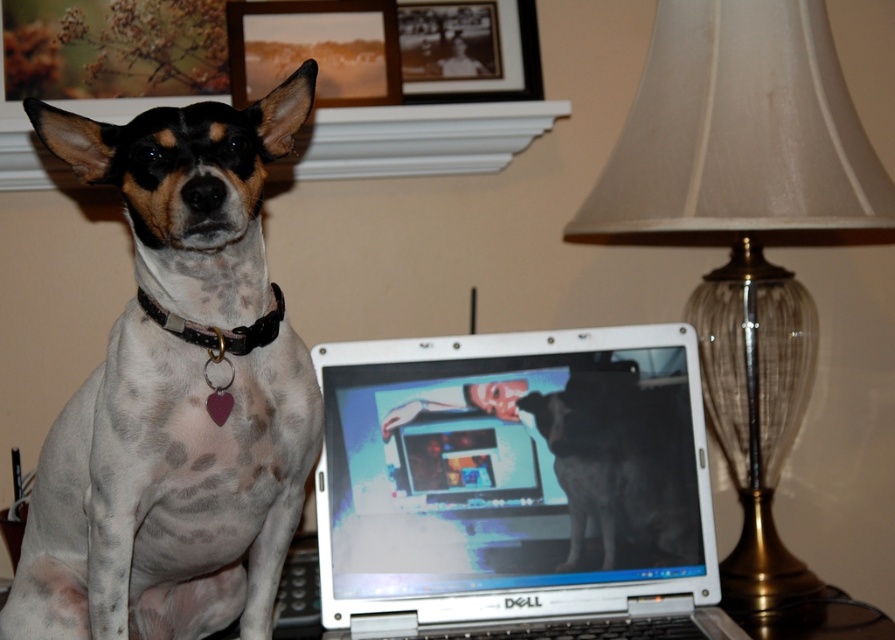
You are a photographer setting up a new shot in this scene. You want to place a small tripod between the speckled fur dog at left and the black matte picture frame at upper center. Based on their current positions, will the tripod fit horizontally between them?

The speckled fur dog at left is positioned on the left side of black matte picture frame at upper center, so there is space between them. The tripod should fit horizontally between them as long as it is placed appropriately.

You are standing at the origin of the coordinate system in the image. There are two points marked in the scene, one at point (655, 548) and another at point (194, 337). Which point is further away from you?

Point (655, 548) is behind point (194, 337), so it is further away from you.